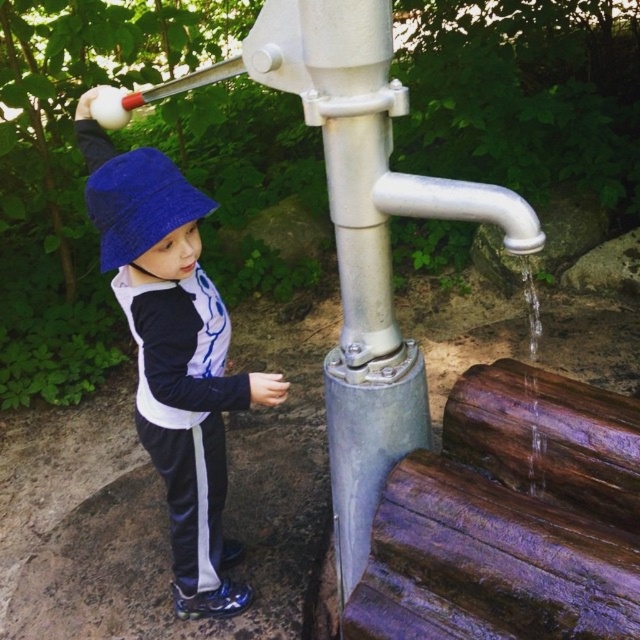
Based on the scene description, can you determine the spatial relationship between the matte blue bucket hat at left and the clear water at lower right?

The matte blue bucket hat at left is located below clear water at lower right.